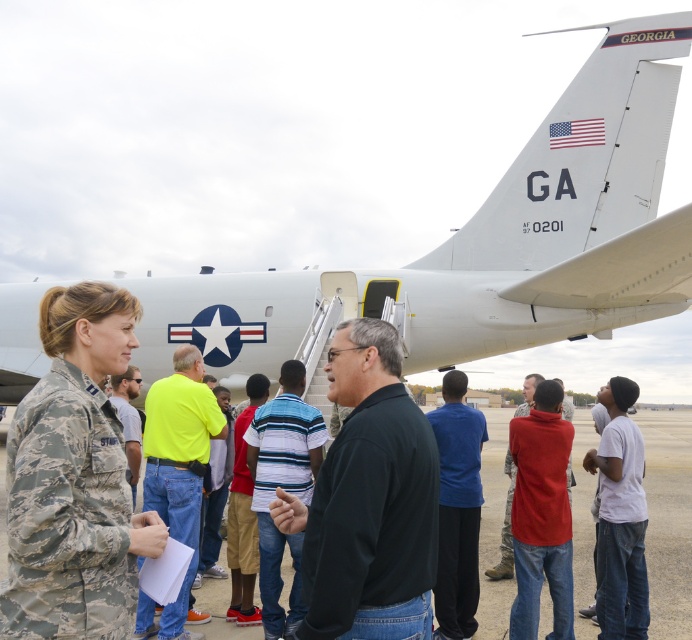
You are a photographer positioned behind the group near the aircraft tail. You want to take a photo of the American flag on the tail fin. Which person, the camouflage uniform at left or the red matte shirt at center, is blocking your view of the flag?

The camouflage uniform at left is blocking your view of the American flag on the tail fin because they are in front of the red matte shirt at center.

You are standing in front of the military aircraft and want to take a photo. You notice two points marked on the tail section. Which point is closer to you, point (x=340, y=451) or point (x=183, y=502)?

Point (x=340, y=451) is closer to you than point (x=183, y=502).

You are standing on the tarmac and see the white matte airplane at center and the black matte shirt at center. From your perspective, which object is positioned to the right?

The white matte airplane at center is to the right of the black matte shirt at center.